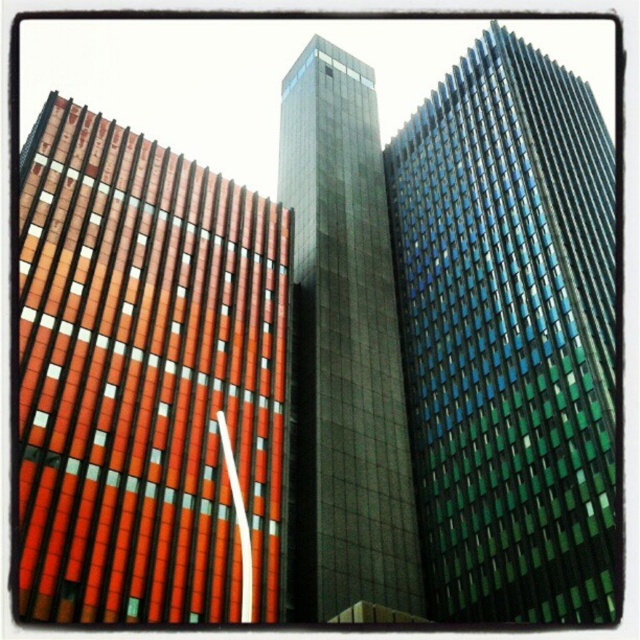
Can you confirm if blue-green glass facade at center is shorter than dark glass tower at center?

Indeed, blue-green glass facade at center has a lesser height compared to dark glass tower at center.

Is blue-green glass facade at center taller than dark glass tower at center?

In fact, blue-green glass facade at center may be shorter than dark glass tower at center.

Which is in front, point (516, 122) or point (378, 339)?

Point (378, 339) is more forward.

At what (x,y) coordinates should I click in order to perform the action: click on blue-green glass facade at center. Please return your answer as a coordinate pair (x, y). The width and height of the screenshot is (640, 640). Looking at the image, I should click on (509, 337).

Is point (248, 250) farther from viewer compared to point (592, 97)?

That is False.

Image resolution: width=640 pixels, height=640 pixels. In order to click on orange brick building at left in this screenshot , I will do `click(147, 380)`.

The height and width of the screenshot is (640, 640). In order to click on orange brick building at left in this screenshot , I will do click(147, 380).

Does orange brick building at left have a smaller size compared to dark glass tower at center?

Yes, orange brick building at left is smaller than dark glass tower at center.

Is orange brick building at left positioned before dark glass tower at center?

Yes, orange brick building at left is closer to the viewer.

This screenshot has height=640, width=640. I want to click on orange brick building at left, so click(147, 380).

The width and height of the screenshot is (640, 640). Identify the location of orange brick building at left. (147, 380).